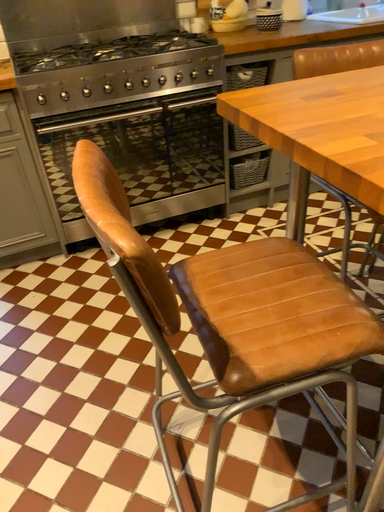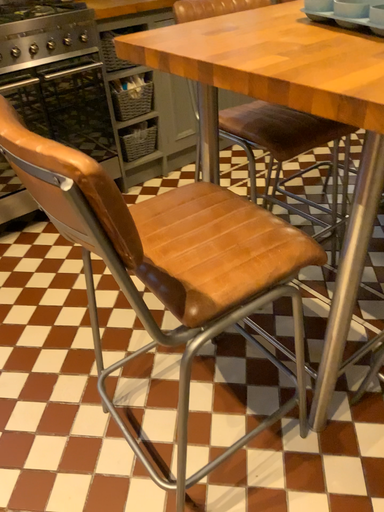
Question: Which way did the camera rotate in the video?

Choices:
 (A) rotated right
 (B) rotated left

Answer: (A)